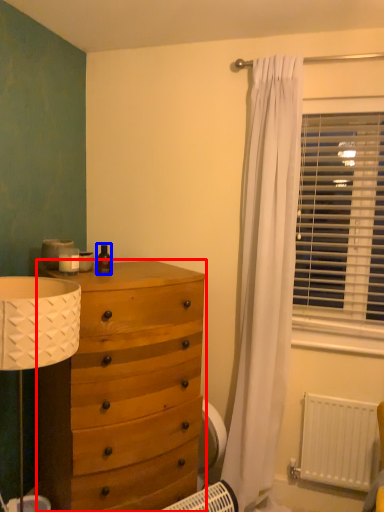
Question: Among these objects, which one is farthest to the camera, chest of drawers (highlighted by a red box) or toiletry (highlighted by a blue box)?

Choices:
 (A) chest of drawers
 (B) toiletry

Answer: (B)